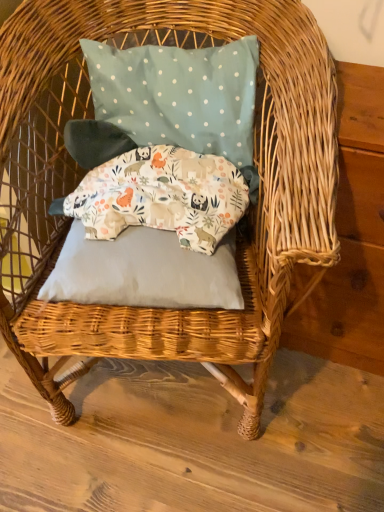
Where is `free space above gray fabric pillow at center, arranged as the first pillow when ordered from the bottom (from a real-world perspective)`? The image size is (384, 512). free space above gray fabric pillow at center, arranged as the first pillow when ordered from the bottom (from a real-world perspective) is located at coordinates (139, 243).